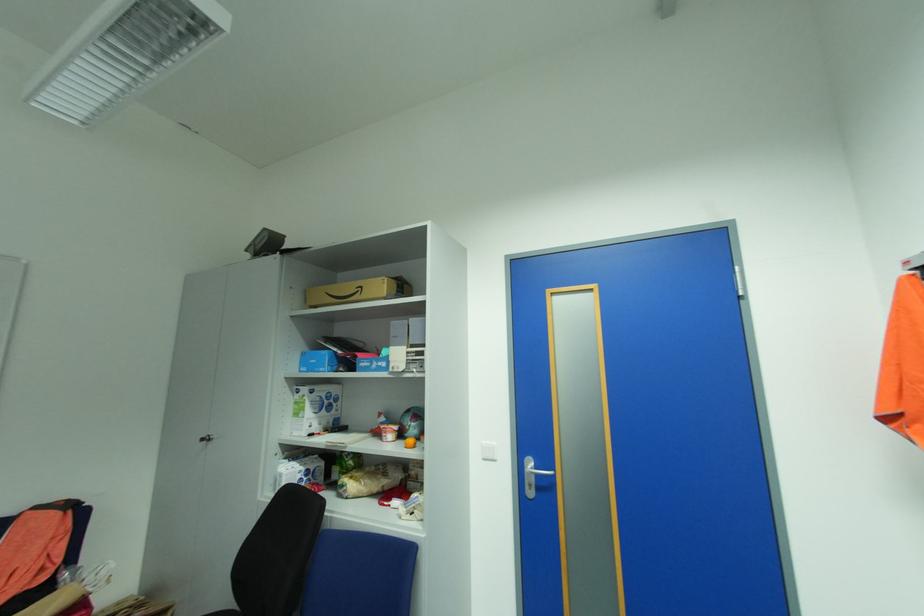
This screenshot has width=924, height=616. I want to click on cabinet handle, so click(x=205, y=439).